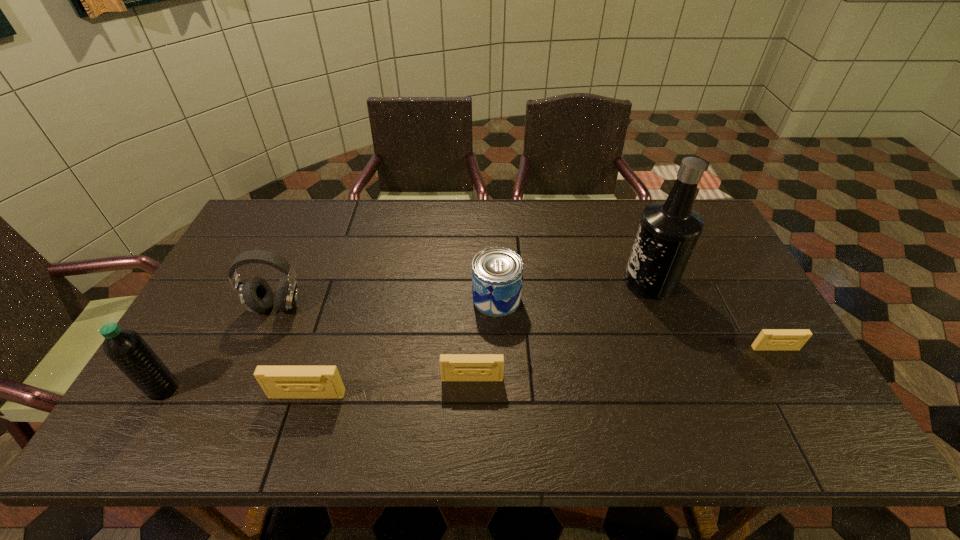
Where is `the leftmost videotape`? This screenshot has height=540, width=960. the leftmost videotape is located at coordinates (278, 382).

In order to click on the nearest videotape in this screenshot , I will do `click(278, 382)`.

This screenshot has height=540, width=960. I want to click on the second videotape from left to right, so click(454, 367).

Identify the location of the second shortest object. (454, 367).

The height and width of the screenshot is (540, 960). I want to click on the shortest videotape, so click(x=768, y=339).

What are the coordinates of `the fourth farthest object` in the screenshot? It's located at point(768,339).

The image size is (960, 540). Identify the location of headset. (256, 295).

This screenshot has width=960, height=540. Find the location of `the second object from right to left`. the second object from right to left is located at coordinates point(669,230).

Find the location of a particular element. The width and height of the screenshot is (960, 540). the tallest object is located at coordinates (669, 230).

Image resolution: width=960 pixels, height=540 pixels. What are the coordinates of `can` in the screenshot? It's located at (497, 272).